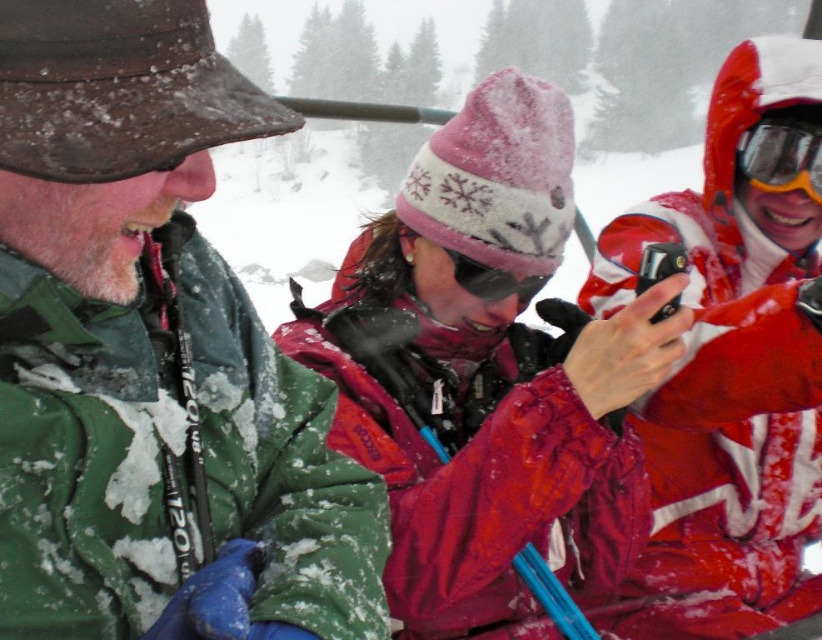
Question: Which point is closer to the camera?

Choices:
 (A) (532, 589)
 (B) (483, 275)
 (C) (603, 316)

Answer: (A)

Question: Considering the relative positions of matte pink knit hat at center and sunglasses at center in the image provided, where is matte pink knit hat at center located with respect to sunglasses at center?

Choices:
 (A) right
 (B) left

Answer: (B)

Question: Which point is closer to the camera?

Choices:
 (A) matte pink knit hat at center
 (B) green matte jacket at left

Answer: (B)

Question: Is matte pink knit hat at center behind sunglasses at center?

Choices:
 (A) no
 (B) yes

Answer: (A)

Question: Can you confirm if green matte jacket at left is positioned to the right of matte red jacket at right?

Choices:
 (A) no
 (B) yes

Answer: (A)

Question: Which point is farther to the camera?

Choices:
 (A) (511, 291)
 (B) (726, 560)
 (C) (816, 172)
 (D) (167, 65)

Answer: (B)